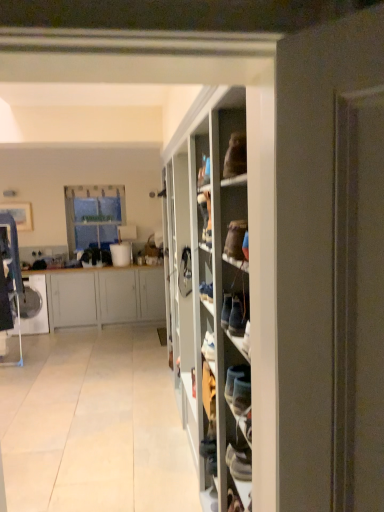
Question: Is clear glass window at upper left further to the viewer compared to white matte cabinet at left?

Choices:
 (A) yes
 (B) no

Answer: (A)

Question: From a real-world perspective, is clear glass window at upper left positioned under white matte cabinet at left based on gravity?

Choices:
 (A) no
 (B) yes

Answer: (A)

Question: Is white matte cabinet at left located within clear glass window at upper left?

Choices:
 (A) yes
 (B) no

Answer: (B)

Question: Is clear glass window at upper left shorter than white matte cabinet at left?

Choices:
 (A) no
 (B) yes

Answer: (A)

Question: Is clear glass window at upper left closer to the viewer compared to white matte cabinet at left?

Choices:
 (A) yes
 (B) no

Answer: (B)

Question: From the image's perspective, is white tile floor at center above or below white matte cabinet at left?

Choices:
 (A) below
 (B) above

Answer: (A)

Question: From a real-world perspective, is white tile floor at center above or below white matte cabinet at left?

Choices:
 (A) below
 (B) above

Answer: (A)

Question: Is white tile floor at center situated inside white matte cabinet at left or outside?

Choices:
 (A) inside
 (B) outside

Answer: (B)

Question: Relative to white matte cabinet at left, is white tile floor at center in front or behind?

Choices:
 (A) behind
 (B) front

Answer: (B)

Question: Based on their sizes in the image, would you say clear glass window at upper left is bigger or smaller than white matte cabinet at left?

Choices:
 (A) big
 (B) small

Answer: (B)

Question: Considering their positions, is clear glass window at upper left located in front of or behind white matte cabinet at left?

Choices:
 (A) behind
 (B) front

Answer: (A)

Question: From a real-world perspective, is clear glass window at upper left positioned above or below white matte cabinet at left?

Choices:
 (A) below
 (B) above

Answer: (B)

Question: Does point (74, 224) appear closer or farther from the camera than point (51, 271)?

Choices:
 (A) closer
 (B) farther

Answer: (B)

Question: From a real-world perspective, relative to white fabric shoe at center, is white matte cabinet at left vertically above or below?

Choices:
 (A) above
 (B) below

Answer: (B)

Question: In terms of width, does white matte cabinet at left look wider or thinner when compared to white fabric shoe at center?

Choices:
 (A) wide
 (B) thin

Answer: (A)